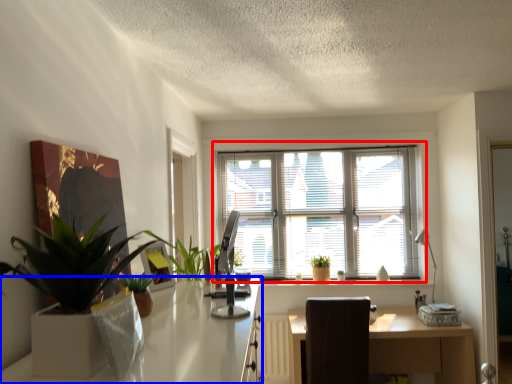
Question: Which object appears closest to the camera in this image, window (highlighted by a red box) or desk (highlighted by a blue box)?

Choices:
 (A) window
 (B) desk

Answer: (B)